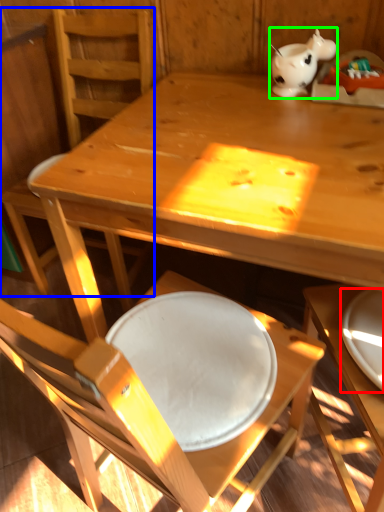
Question: Which object is positioned closest to plate (highlighted by a red box)? Select from chair (highlighted by a blue box) and tableware (highlighted by a green box).

Choices:
 (A) chair
 (B) tableware

Answer: (B)